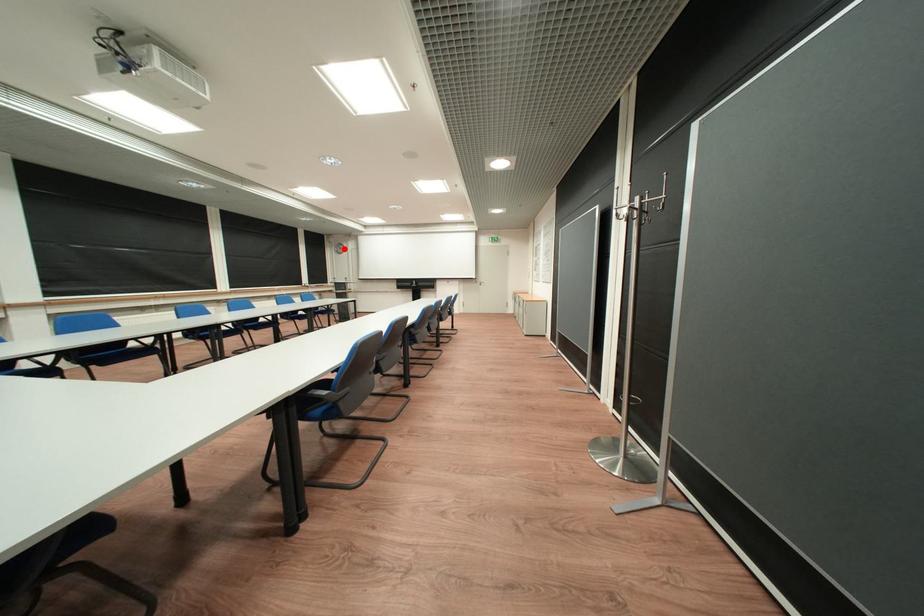
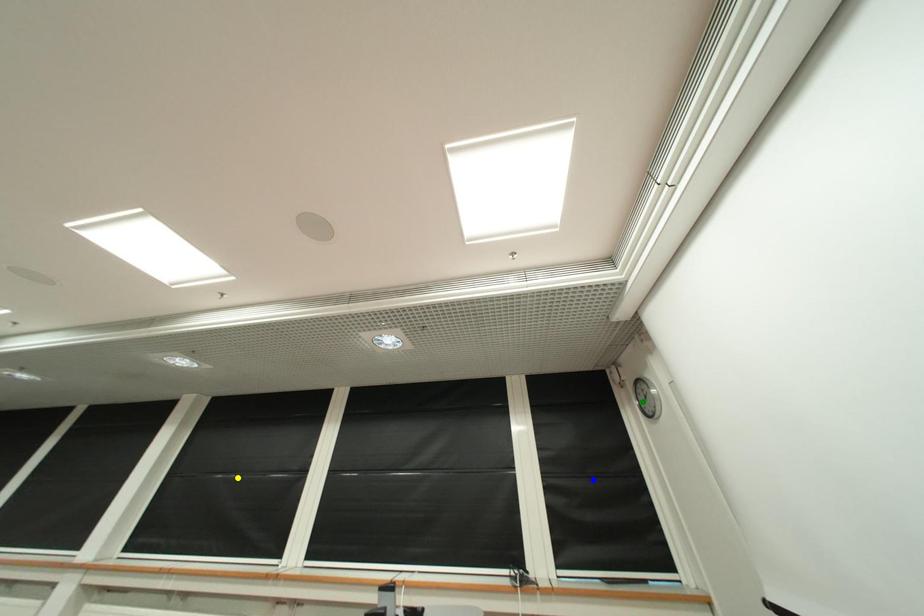
Question: I am providing you with two images of the same scene from different viewpoints. A red point is marked on the first image. You are given multiple points on the second image. Which point in image 2 is actually the same real-world point as the red point in image 1?

Choices:
 (A) yellow point
 (B) blue point
 (C) green point

Answer: (C)